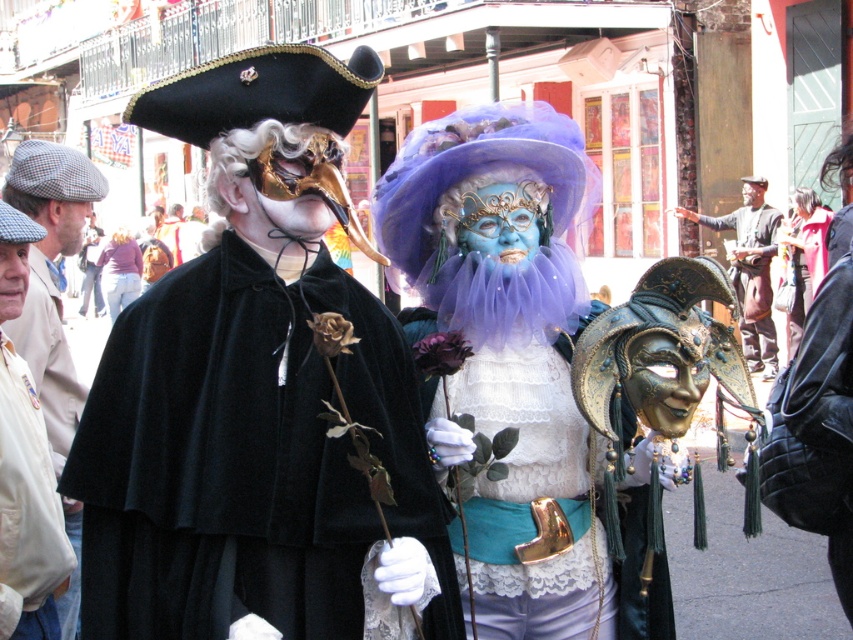
Question: Can you confirm if white cotton shirt at lower left is positioned to the right of brown leather jacket at upper right?

Choices:
 (A) yes
 (B) no

Answer: (B)

Question: Can you confirm if light beige fabric cap at left is positioned below white cotton shirt at lower left?

Choices:
 (A) yes
 (B) no

Answer: (B)

Question: Which of the following is the farthest from the observer?

Choices:
 (A) brown leather jacket at upper right
 (B) light pink fabric pants at lower left
 (C) velvet black cape at center

Answer: (B)

Question: Among these points, which one is nearest to the camera?

Choices:
 (A) [811, 230]
 (B) [288, 548]
 (C) [764, 278]
 (D) [51, 628]

Answer: (B)

Question: Does velvet black cape at center have a greater width compared to light beige fabric cap at left?

Choices:
 (A) yes
 (B) no

Answer: (B)

Question: Which point appears closest to the camera in this image?

Choices:
 (A) (351, 477)
 (B) (109, 250)
 (C) (26, 163)

Answer: (A)